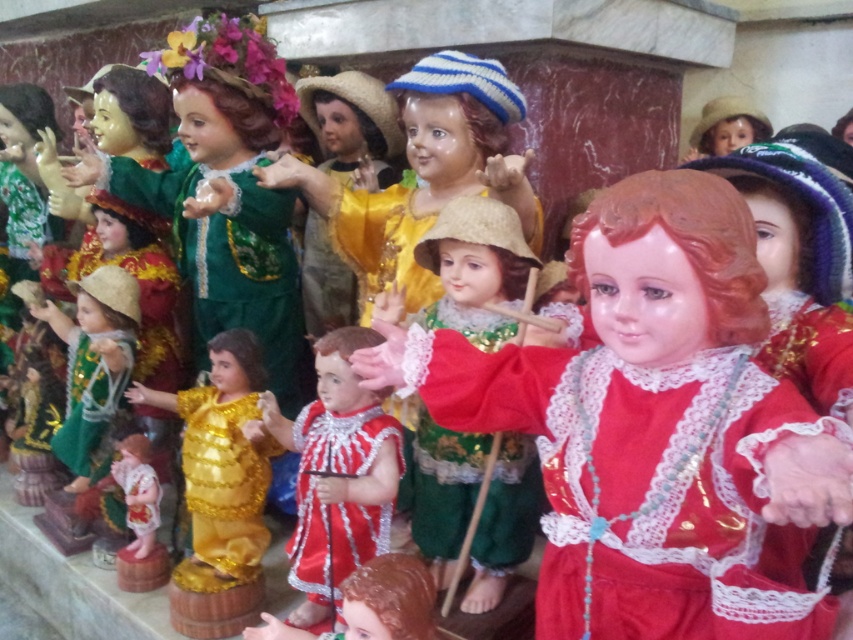
Is point (577, 234) positioned before point (500, 234)?

Yes, it is in front of point (500, 234).

Which of these two, shiny red porcelain doll at center or shiny green fabric doll at center, stands taller?

shiny red porcelain doll at center is taller.

Locate an element on the screen. This screenshot has width=853, height=640. shiny red porcelain doll at center is located at coordinates (654, 428).

Locate an element on the screen. The width and height of the screenshot is (853, 640). shiny red porcelain doll at center is located at coordinates (654, 428).